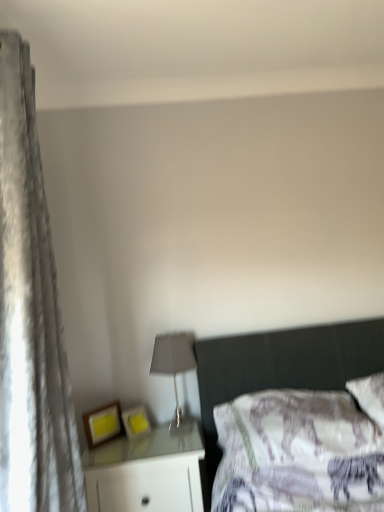
Where is `white glossy nightstand at lower left`? This screenshot has width=384, height=512. white glossy nightstand at lower left is located at coordinates (146, 473).

Describe the element at coordinates (146, 473) in the screenshot. I see `white glossy nightstand at lower left` at that location.

What is the approximate height of velvet gray curtain at left?

velvet gray curtain at left is 5.85 feet in height.

What do you see at coordinates (136, 422) in the screenshot?
I see `matte yellow picture frame at lower center, the 2th picture frame in the left-to-right sequence` at bounding box center [136, 422].

What is the approximate height of matte wooden picture frame at lower left, which ranks as the 2th picture frame in right-to-left order?

matte wooden picture frame at lower left, which ranks as the 2th picture frame in right-to-left order, is 7.37 inches in height.

Measure the distance between matte wooden picture frame at lower left, which ranks as the 2th picture frame in right-to-left order, and camera.

The distance of matte wooden picture frame at lower left, which ranks as the 2th picture frame in right-to-left order, from camera is 6.56 feet.

At what (x,y) coordinates should I click in order to perform the action: click on matte gray lampshade at center. Please return your answer as a coordinate pair (x, y). This screenshot has width=384, height=512. Looking at the image, I should click on (174, 369).

Where is `white glossy nightstand at lower left`? The width and height of the screenshot is (384, 512). white glossy nightstand at lower left is located at coordinates (146, 473).

Based on the photo, does matte yellow picture frame at lower center, the 1th picture frame when ordered from right to left, appear on the right side of white glossy nightstand at lower left?

No, matte yellow picture frame at lower center, the 1th picture frame when ordered from right to left, is not to the right of white glossy nightstand at lower left.

From the image's perspective, is matte yellow picture frame at lower center, the 2th picture frame in the left-to-right sequence, on top of white glossy nightstand at lower left?

Yes.

Is point (135, 438) positioned in front of point (178, 496)?

No, (135, 438) is further to viewer.

Who is smaller, matte yellow picture frame at lower center, the 1th picture frame when ordered from right to left, or white glossy nightstand at lower left?

matte yellow picture frame at lower center, the 1th picture frame when ordered from right to left.

From a real-world perspective, who is located higher, matte wooden picture frame at lower left, which is the first picture frame in left-to-right order, or velvet gray curtain at left?

velvet gray curtain at left.

Based on the photo, considering the sizes of objects matte wooden picture frame at lower left, which is the first picture frame in left-to-right order, and velvet gray curtain at left in the image provided, who is shorter, matte wooden picture frame at lower left, which is the first picture frame in left-to-right order, or velvet gray curtain at left?

Standing shorter between the two is matte wooden picture frame at lower left, which is the first picture frame in left-to-right order.

Is matte wooden picture frame at lower left, which is the first picture frame in left-to-right order, looking in the opposite direction of velvet gray curtain at left?

No, matte wooden picture frame at lower left, which is the first picture frame in left-to-right order, is not facing the opposite direction of velvet gray curtain at left.

Between matte wooden picture frame at lower left, which is the first picture frame in left-to-right order, and velvet gray curtain at left, which one appears on the left side from the viewer's perspective?

Positioned to the left is velvet gray curtain at left.

How different are the orientations of matte wooden picture frame at lower left, which is the first picture frame in left-to-right order, and matte gray lampshade at center in degrees?

The angle between the facing direction of matte wooden picture frame at lower left, which is the first picture frame in left-to-right order, and the facing direction of matte gray lampshade at center is 44.5 degrees.

Could you tell me if matte wooden picture frame at lower left, which is the first picture frame in left-to-right order, is facing matte gray lampshade at center?

No.

From the image's perspective, does matte wooden picture frame at lower left, which ranks as the 2th picture frame in right-to-left order, appear lower than matte gray lampshade at center?

Indeed, from the image's perspective, matte wooden picture frame at lower left, which ranks as the 2th picture frame in right-to-left order, is shown beneath matte gray lampshade at center.

From the image's perspective, is matte gray lampshade at center located above or below matte yellow picture frame at lower center, the 1th picture frame when ordered from right to left?

Based on their image positions, matte gray lampshade at center is located above matte yellow picture frame at lower center, the 1th picture frame when ordered from right to left.

In terms of size, does matte gray lampshade at center appear bigger or smaller than matte yellow picture frame at lower center, the 2th picture frame in the left-to-right sequence?

Clearly, matte gray lampshade at center is larger in size than matte yellow picture frame at lower center, the 2th picture frame in the left-to-right sequence.

There is a matte gray lampshade at center. Find the location of `the 2nd picture frame below it (from the image's perspective)`. the 2nd picture frame below it (from the image's perspective) is located at coordinates (136, 422).

Considering the sizes of objects matte gray lampshade at center and matte yellow picture frame at lower center, the 1th picture frame when ordered from right to left, in the image provided, who is thinner, matte gray lampshade at center or matte yellow picture frame at lower center, the 1th picture frame when ordered from right to left,?

Thinner between the two is matte yellow picture frame at lower center, the 1th picture frame when ordered from right to left.

Is matte yellow picture frame at lower center, the 2th picture frame in the left-to-right sequence, positioned with its back to matte gray lampshade at center?

That's not correct — matte yellow picture frame at lower center, the 2th picture frame in the left-to-right sequence, is not looking away from matte gray lampshade at center.

Does point (127, 424) lie behind point (182, 361)?

No, (127, 424) is closer to viewer.

From a real-world perspective, who is located lower, matte yellow picture frame at lower center, the 1th picture frame when ordered from right to left, or matte gray lampshade at center?

matte yellow picture frame at lower center, the 1th picture frame when ordered from right to left, is physically lower.

In the image, is matte yellow picture frame at lower center, the 2th picture frame in the left-to-right sequence, positioned in front of or behind matte gray lampshade at center?

In the image, matte yellow picture frame at lower center, the 2th picture frame in the left-to-right sequence, appears behind matte gray lampshade at center.

Is white glossy nightstand at lower left next to matte yellow picture frame at lower center, the 2th picture frame in the left-to-right sequence?

No, white glossy nightstand at lower left is not touching matte yellow picture frame at lower center, the 2th picture frame in the left-to-right sequence.

Does white glossy nightstand at lower left lie in front of matte yellow picture frame at lower center, the 2th picture frame in the left-to-right sequence?

Yes.

Is white glossy nightstand at lower left to the left or to the right of matte yellow picture frame at lower center, the 2th picture frame in the left-to-right sequence, in the image?

Clearly, white glossy nightstand at lower left is on the right of matte yellow picture frame at lower center, the 2th picture frame in the left-to-right sequence, in the image.

From a real-world perspective, which is physically above, white glossy nightstand at lower left or matte yellow picture frame at lower center, the 2th picture frame in the left-to-right sequence?

matte yellow picture frame at lower center, the 2th picture frame in the left-to-right sequence, from a real-world perspective.

Is there a large distance between velvet gray curtain at left and matte wooden picture frame at lower left, which ranks as the 2th picture frame in right-to-left order?

No, there isn't a large distance between velvet gray curtain at left and matte wooden picture frame at lower left, which ranks as the 2th picture frame in right-to-left order.

Is matte wooden picture frame at lower left, which ranks as the 2th picture frame in right-to-left order, surrounded by velvet gray curtain at left?

No, matte wooden picture frame at lower left, which ranks as the 2th picture frame in right-to-left order, is not inside velvet gray curtain at left.

How distant is velvet gray curtain at left from matte wooden picture frame at lower left, which is the first picture frame in left-to-right order?

The distance of velvet gray curtain at left from matte wooden picture frame at lower left, which is the first picture frame in left-to-right order, is 31.47 inches.

From the image's perspective, does velvet gray curtain at left appear higher than matte wooden picture frame at lower left, which ranks as the 2th picture frame in right-to-left order?

Yes.

From a real-world perspective, count 1st picture frames upward from the white glossy nightstand at lower left and point to it. Please provide its 2D coordinates.

[(136, 422)]

You are a GUI agent. You are given a task and a screenshot of the screen. Output one action in this format:
    pyautogui.click(x=<x>, y=<y>)
    Task: Click on the curtain on the left of matte wooden picture frame at lower left, which ranks as the 2th picture frame in right-to-left order
    
    Given the screenshot: What is the action you would take?
    pyautogui.click(x=30, y=315)

Based on their spatial positions, is matte gray lampshade at center or matte yellow picture frame at lower center, the 1th picture frame when ordered from right to left, further from white glossy nightstand at lower left?

matte gray lampshade at center is positioned further to the anchor white glossy nightstand at lower left.

Looking at the image, which one is located closer to white glossy nightstand at lower left, matte wooden picture frame at lower left, which is the first picture frame in left-to-right order, or velvet gray curtain at left?

Among the two, matte wooden picture frame at lower left, which is the first picture frame in left-to-right order, is located nearer to white glossy nightstand at lower left.

Which object lies further to the anchor point matte gray lampshade at center, matte wooden picture frame at lower left, which is the first picture frame in left-to-right order, or velvet gray curtain at left?

velvet gray curtain at left.

Based on their spatial positions, is matte gray lampshade at center or matte wooden picture frame at lower left, which is the first picture frame in left-to-right order, further from white glossy nightstand at lower left?

matte gray lampshade at center.

Which object lies nearer to the anchor point matte yellow picture frame at lower center, the 1th picture frame when ordered from right to left, white glossy nightstand at lower left or velvet gray curtain at left?

Among the two, white glossy nightstand at lower left is located nearer to matte yellow picture frame at lower center, the 1th picture frame when ordered from right to left.

From the image, which object appears to be farther from velvet gray curtain at left, matte gray lampshade at center or white glossy nightstand at lower left?

matte gray lampshade at center lies further to velvet gray curtain at left than the other object.

When comparing their distances from matte yellow picture frame at lower center, the 1th picture frame when ordered from right to left, does matte wooden picture frame at lower left, which ranks as the 2th picture frame in right-to-left order, or white glossy nightstand at lower left seem closer?

The object closer to matte yellow picture frame at lower center, the 1th picture frame when ordered from right to left, is matte wooden picture frame at lower left, which ranks as the 2th picture frame in right-to-left order.

Looking at the image, which one is located further to velvet gray curtain at left, matte yellow picture frame at lower center, the 1th picture frame when ordered from right to left, or white glossy nightstand at lower left?

The object further to velvet gray curtain at left is matte yellow picture frame at lower center, the 1th picture frame when ordered from right to left.

Find the location of a particular element. The width and height of the screenshot is (384, 512). picture frame between matte wooden picture frame at lower left, which is the first picture frame in left-to-right order, and matte gray lampshade at center, in the horizontal direction is located at coordinates (136, 422).

Where is `lamp between velvet gray curtain at left and matte yellow picture frame at lower center, the 2th picture frame in the left-to-right sequence, in the front-back direction`? The width and height of the screenshot is (384, 512). lamp between velvet gray curtain at left and matte yellow picture frame at lower center, the 2th picture frame in the left-to-right sequence, in the front-back direction is located at coordinates (174, 369).

The image size is (384, 512). I want to click on picture frame positioned between velvet gray curtain at left and matte yellow picture frame at lower center, the 1th picture frame when ordered from right to left, from near to far, so click(102, 424).

Find the location of a particular element. picture frame between matte wooden picture frame at lower left, which ranks as the 2th picture frame in right-to-left order, and white glossy nightstand at lower left in the up-down direction is located at coordinates (136, 422).